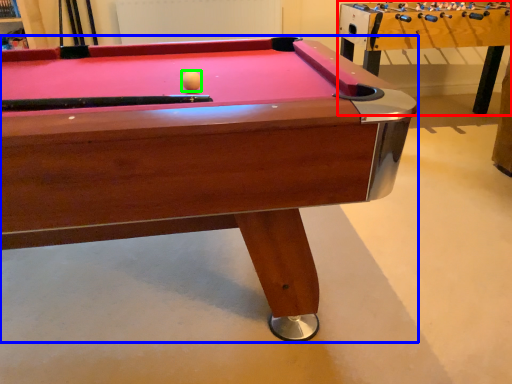
Question: Which is farther away from table (highlighted by a red box)? billiard table (highlighted by a blue box) or ball (highlighted by a green box)?

Choices:
 (A) billiard table
 (B) ball

Answer: (B)